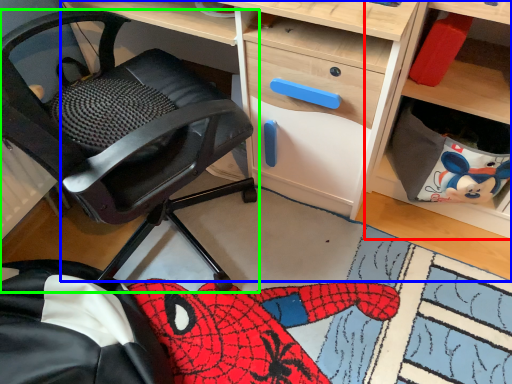
Question: Considering the real-world distances, which object is farthest from shelf (highlighted by a red box)? desk (highlighted by a blue box) or chair (highlighted by a green box)?

Choices:
 (A) desk
 (B) chair

Answer: (B)